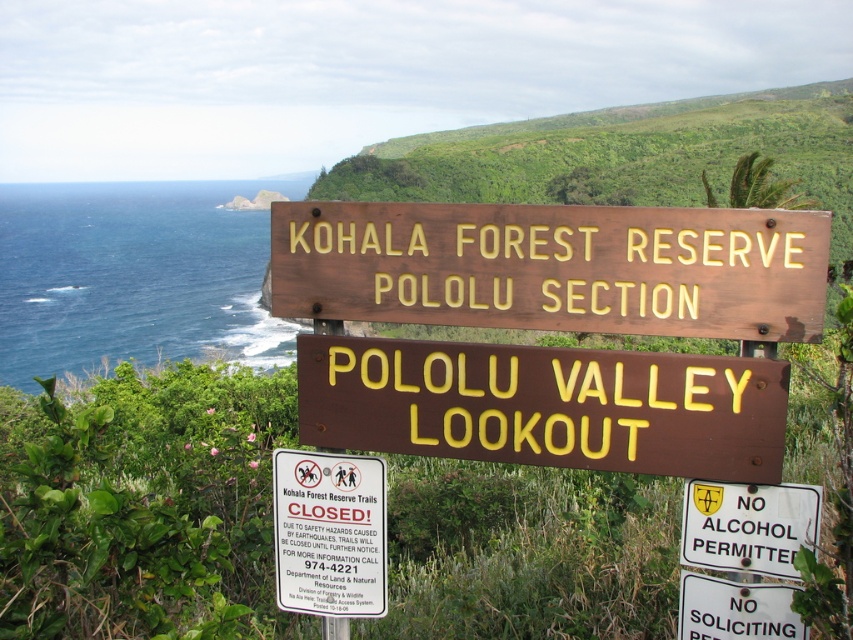
You are a hiker planning to visit the trails mentioned on the white paper sign at center and the white plastic sign at center. Before proceeding, you need to check which sign has a bigger size to prioritize reading the larger one first. Which sign should you read first?

The white paper sign at center has a larger size compared to the white plastic sign at center, so you should read the white paper sign at center first.

You are a hiker planning to visit the Pololu Valley Lookout. You see the brown wooden sign at center and the brown polished wood sign at center. Which one is closer to you?

The brown wooden sign at center is closer to you because it is in front of the brown polished wood sign at center.

You are standing at the KOHALA FOREST RESERVE POLOLU SECTION sign and want to reach the lookout. There are two points marked on the path ahead. Which point should you go to first to reach the lookout? The points are point (630, 413) and point (685, 600).

You should go to point (630, 413) first because it is in front of point (685, 600) along the path to the lookout.